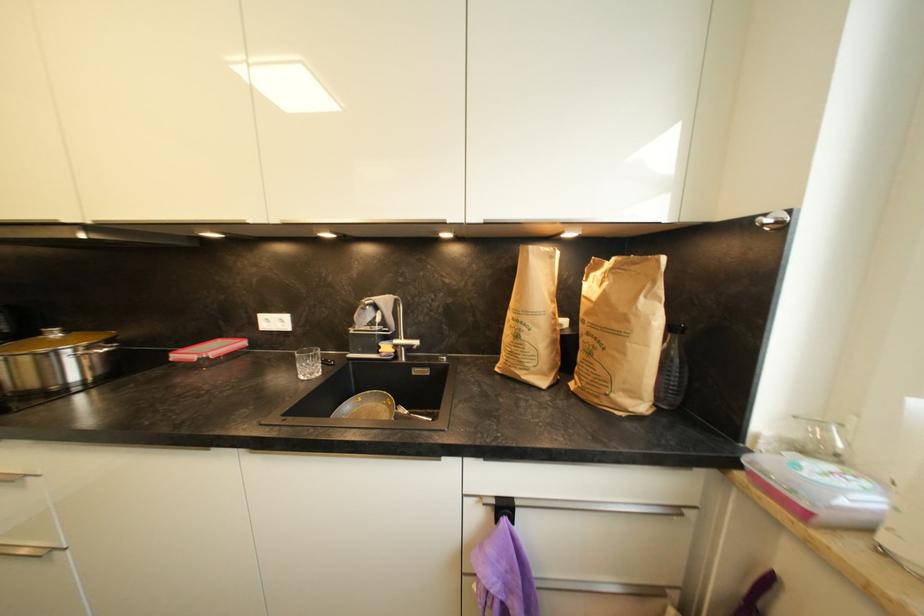
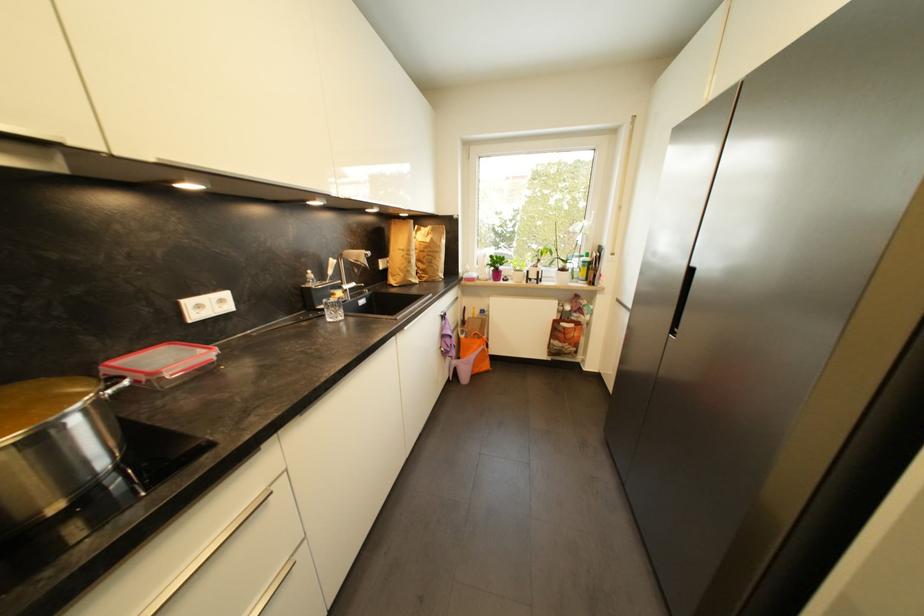
Question: I am providing you with two images of the same scene from different viewpoints. After the viewpoint changes to image2, which objects are now occluded?

Choices:
 (A) silver drawer handle
 (B) white window handle
 (C) faucet handle
 (D) none of these

Answer: (D)